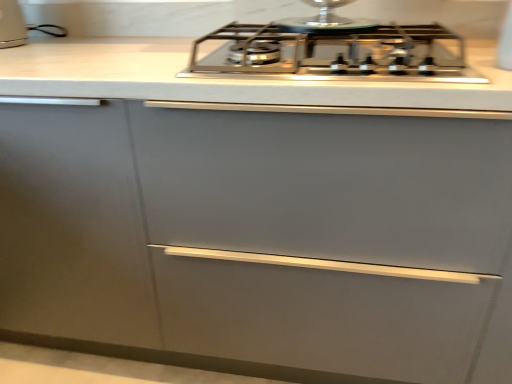
Question: From their relative heights in the image, would you say white glossy toaster at upper left is taller or shorter than satin silver gas stove at center?

Choices:
 (A) short
 (B) tall

Answer: (B)

Question: In terms of width, does white glossy toaster at upper left look wider or thinner when compared to satin silver gas stove at center?

Choices:
 (A) thin
 (B) wide

Answer: (A)

Question: Considering the positions of point (20, 13) and point (394, 74), is point (20, 13) closer or farther from the camera than point (394, 74)?

Choices:
 (A) closer
 (B) farther

Answer: (B)

Question: Considering the positions of satin silver gas stove at center and white glossy toaster at upper left in the image, is satin silver gas stove at center taller or shorter than white glossy toaster at upper left?

Choices:
 (A) tall
 (B) short

Answer: (B)

Question: Considering the positions of satin silver gas stove at center and white glossy toaster at upper left in the image, is satin silver gas stove at center bigger or smaller than white glossy toaster at upper left?

Choices:
 (A) big
 (B) small

Answer: (A)

Question: Would you say satin silver gas stove at center is inside or outside white glossy toaster at upper left?

Choices:
 (A) inside
 (B) outside

Answer: (B)

Question: Considering the positions of point (309, 49) and point (6, 18), is point (309, 49) closer or farther from the camera than point (6, 18)?

Choices:
 (A) farther
 (B) closer

Answer: (B)